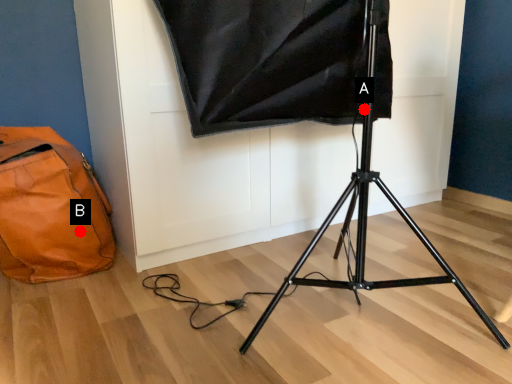
Question: Two points are circled on the image, labeled by A and B beside each circle. Which point is further to the camera?

Choices:
 (A) A is further
 (B) B is further

Answer: (B)